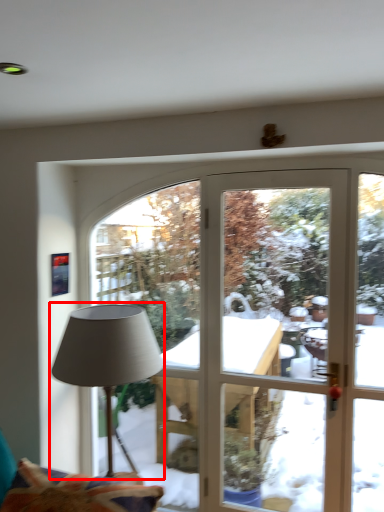
Question: From the image, what is the correct spatial relationship of lamp (annotated by the red box) in relation to swivel chair?

Choices:
 (A) right
 (B) left

Answer: (A)